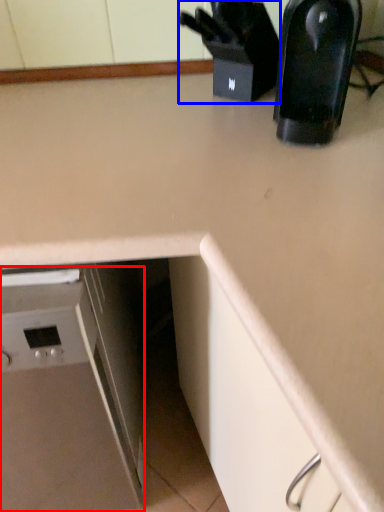
Question: Which point is closer to the camera, home appliance (highlighted by a red box) or appliance (highlighted by a blue box)?

Choices:
 (A) home appliance
 (B) appliance

Answer: (A)